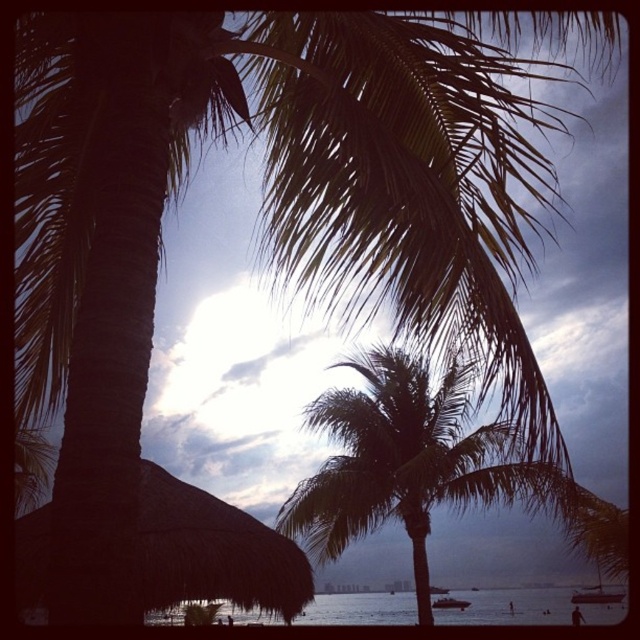
Is transparent water at lower center to the right of white glossy boat at lower center from the viewer's perspective?

In fact, transparent water at lower center is to the left of white glossy boat at lower center.

Identify the location of transparent water at lower center. (509, 605).

What are the coordinates of `transparent water at lower center` in the screenshot? It's located at (509, 605).

Measure the distance between thatched brown hut at lower left and transparent water at lower center.

thatched brown hut at lower left is 5.23 meters away from transparent water at lower center.

Locate an element on the screen. The height and width of the screenshot is (640, 640). thatched brown hut at lower left is located at coordinates (212, 550).

Who is positioned more to the left, dark green leafy palm tree at center or transparent water at lower center?

dark green leafy palm tree at center is more to the left.

At what (x,y) coordinates should I click in order to perform the action: click on dark green leafy palm tree at center. Please return your answer as a coordinate pair (x, y). The height and width of the screenshot is (640, 640). Looking at the image, I should click on (406, 461).

Is point (474, 467) positioned after point (467, 612)?

No.

I want to click on dark green leafy palm tree at center, so click(406, 461).